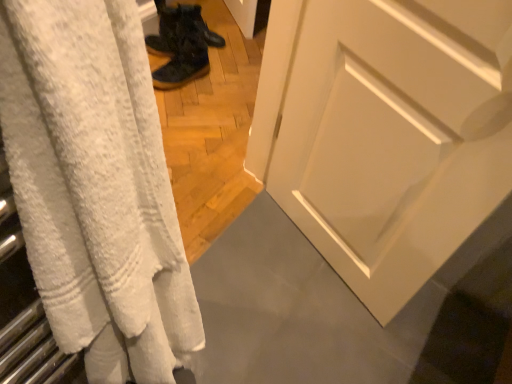
What do you see at coordinates (213, 37) in the screenshot?
I see `dark matte boots at center, placed as the 2th footwear when sorted from front to back` at bounding box center [213, 37].

Where is `camouflage fabric boots at center, marked as the first footwear in a front-to-back arrangement`? This screenshot has width=512, height=384. camouflage fabric boots at center, marked as the first footwear in a front-to-back arrangement is located at coordinates (180, 46).

Which is farther, (161, 9) or (96, 251)?

The point (161, 9) is farther from the camera.

What's the angular difference between camouflage fabric boots at center, marked as the first footwear in a front-to-back arrangement, and white textured towel at left's facing directions?

168 degrees.

Considering the relative positions of camouflage fabric boots at center, the second footwear when ordered from back to front, and white textured towel at left in the image provided, is camouflage fabric boots at center, the second footwear when ordered from back to front, to the right of white textured towel at left from the viewer's perspective?

Incorrect, camouflage fabric boots at center, the second footwear when ordered from back to front, is not on the right side of white textured towel at left.

From the picture: From a real-world perspective, between camouflage fabric boots at center, marked as the first footwear in a front-to-back arrangement, and white textured towel at left, who is vertically higher?

white textured towel at left, from a real-world perspective.

Looking at the image, does dark matte boots at center, placed as the 2th footwear when sorted from front to back, seem bigger or smaller compared to white textured towel at left?

dark matte boots at center, placed as the 2th footwear when sorted from front to back, is smaller than white textured towel at left.

Is dark matte boots at center, which is the 1th footwear from back to front, far from white textured towel at left?

Yes, dark matte boots at center, which is the 1th footwear from back to front, and white textured towel at left are located far from each other.

From a real-world perspective, relative to white textured towel at left, is dark matte boots at center, which is the 1th footwear from back to front, vertically above or below?

dark matte boots at center, which is the 1th footwear from back to front, is situated lower than white textured towel at left in the real world.

In order to click on the 2nd footwear behind the white textured towel at left, starting your count from the anchor in this screenshot , I will do `click(213, 37)`.

Could you measure the distance between white textured towel at left and dark matte boots at center, placed as the 2th footwear when sorted from front to back?

The distance of white textured towel at left from dark matte boots at center, placed as the 2th footwear when sorted from front to back, is 5.47 feet.

From the image's perspective, is white textured towel at left positioned above or below dark matte boots at center, which is the 1th footwear from back to front?

white textured towel at left is situated lower than dark matte boots at center, which is the 1th footwear from back to front, in the image.

Between white textured towel at left and dark matte boots at center, placed as the 2th footwear when sorted from front to back, which one is positioned behind?

dark matte boots at center, placed as the 2th footwear when sorted from front to back.

From a real-world perspective, relative to camouflage fabric boots at center, marked as the first footwear in a front-to-back arrangement, is white textured towel at left vertically above or below?

Clearly, from a real-world perspective, white textured towel at left is above camouflage fabric boots at center, marked as the first footwear in a front-to-back arrangement.

Can you confirm if white textured towel at left is wider than camouflage fabric boots at center, the second footwear when ordered from back to front?

No, white textured towel at left is not wider than camouflage fabric boots at center, the second footwear when ordered from back to front.

How many degrees apart are the facing directions of white textured towel at left and camouflage fabric boots at center, marked as the first footwear in a front-to-back arrangement?

168 degrees.

Is dark matte boots at center, placed as the 2th footwear when sorted from front to back, to the left or to the right of camouflage fabric boots at center, marked as the first footwear in a front-to-back arrangement, in the image?

Clearly, dark matte boots at center, placed as the 2th footwear when sorted from front to back, is on the right of camouflage fabric boots at center, marked as the first footwear in a front-to-back arrangement, in the image.

From the image's perspective, which one is positioned lower, dark matte boots at center, which is the 1th footwear from back to front, or camouflage fabric boots at center, marked as the first footwear in a front-to-back arrangement?

camouflage fabric boots at center, marked as the first footwear in a front-to-back arrangement, from the image's perspective.

Which is behind, point (208, 37) or point (182, 32)?

Positioned behind is point (208, 37).

Looking at this image, is dark matte boots at center, which is the 1th footwear from back to front, not close to camouflage fabric boots at center, the second footwear when ordered from back to front?

No, dark matte boots at center, which is the 1th footwear from back to front, is not far away from camouflage fabric boots at center, the second footwear when ordered from back to front.

Does camouflage fabric boots at center, the second footwear when ordered from back to front, have a lesser width compared to dark matte boots at center, placed as the 2th footwear when sorted from front to back?

Incorrect, the width of camouflage fabric boots at center, the second footwear when ordered from back to front, is not less than that of dark matte boots at center, placed as the 2th footwear when sorted from front to back.

Between camouflage fabric boots at center, the second footwear when ordered from back to front, and dark matte boots at center, which is the 1th footwear from back to front, which one has more height?

→ camouflage fabric boots at center, the second footwear when ordered from back to front.

Find the location of a particular element. The height and width of the screenshot is (384, 512). curtain above the camouflage fabric boots at center, marked as the first footwear in a front-to-back arrangement (from a real-world perspective) is located at coordinates (95, 187).

Starting from the white textured towel at left, which footwear is the 2nd one behind? Please provide its 2D coordinates.

[(213, 37)]

Looking at the image, which one is located further to camouflage fabric boots at center, the second footwear when ordered from back to front, white textured towel at left or dark matte boots at center, which is the 1th footwear from back to front?

Among the two, white textured towel at left is located further to camouflage fabric boots at center, the second footwear when ordered from back to front.

Considering their positions, is camouflage fabric boots at center, marked as the first footwear in a front-to-back arrangement, positioned further to white textured towel at left than dark matte boots at center, which is the 1th footwear from back to front?

The object further to white textured towel at left is dark matte boots at center, which is the 1th footwear from back to front.

When comparing their distances from camouflage fabric boots at center, the second footwear when ordered from back to front, does dark matte boots at center, which is the 1th footwear from back to front, or white textured towel at left seem closer?

dark matte boots at center, which is the 1th footwear from back to front.

In the scene shown: Considering their positions, is camouflage fabric boots at center, the second footwear when ordered from back to front, positioned closer to dark matte boots at center, placed as the 2th footwear when sorted from front to back, than white textured towel at left?

Based on the image, camouflage fabric boots at center, the second footwear when ordered from back to front, appears to be nearer to dark matte boots at center, placed as the 2th footwear when sorted from front to back.

From the picture: Which object lies further to the anchor point dark matte boots at center, which is the 1th footwear from back to front, white textured towel at left or camouflage fabric boots at center, the second footwear when ordered from back to front?

The object further to dark matte boots at center, which is the 1th footwear from back to front, is white textured towel at left.

Which object lies nearer to the anchor point white textured towel at left, dark matte boots at center, which is the 1th footwear from back to front, or camouflage fabric boots at center, marked as the first footwear in a front-to-back arrangement?

The object closer to white textured towel at left is camouflage fabric boots at center, marked as the first footwear in a front-to-back arrangement.

The image size is (512, 384). Find the location of `footwear positioned between white textured towel at left and dark matte boots at center, placed as the 2th footwear when sorted from front to back, from near to far`. footwear positioned between white textured towel at left and dark matte boots at center, placed as the 2th footwear when sorted from front to back, from near to far is located at coordinates (180, 46).